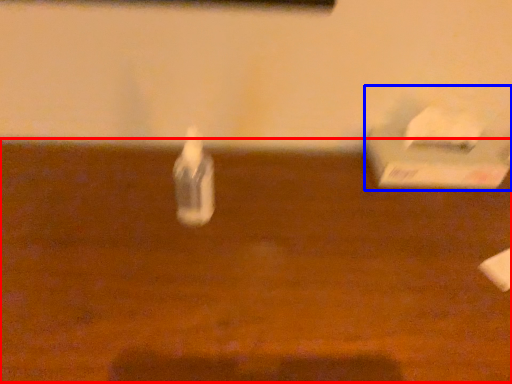
Question: Which object is further to the camera taking this photo, table (highlighted by a red box) or box (highlighted by a blue box)?

Choices:
 (A) table
 (B) box

Answer: (B)